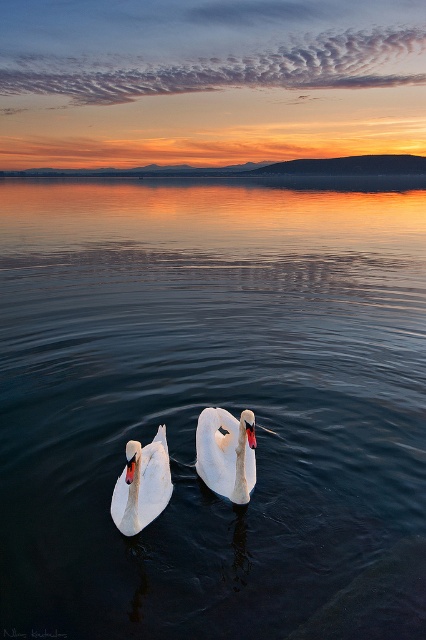
Question: Which point is farther to the camera?

Choices:
 (A) white glossy swan at center
 (B) white glossy swan at lower left

Answer: (A)

Question: Which object is farther from the camera taking this photo?

Choices:
 (A) white glossy swan at lower left
 (B) white glossy swan at center
 (C) smooth dark water at center

Answer: (B)

Question: Is white glossy swan at center further to camera compared to white glossy swan at lower left?

Choices:
 (A) yes
 (B) no

Answer: (A)

Question: Is the position of smooth dark water at center more distant than that of white glossy swan at lower left?

Choices:
 (A) no
 (B) yes

Answer: (B)

Question: Estimate the real-world distances between objects in this image. Which object is farther from the white glossy swan at center?

Choices:
 (A) white glossy swan at lower left
 (B) smooth dark water at center

Answer: (B)

Question: Can you confirm if white glossy swan at center is positioned to the right of white glossy swan at lower left?

Choices:
 (A) yes
 (B) no

Answer: (A)